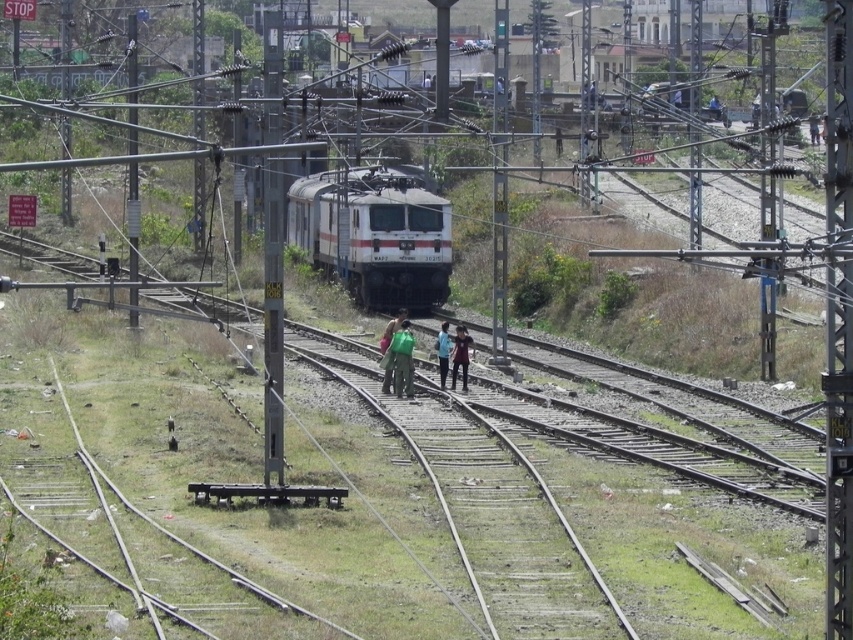
Question: Which point is farther to the camera?

Choices:
 (A) green fabric bag at center
 (B) green fabric at center
 (C) dark blue shirt at center

Answer: (C)

Question: Can you confirm if white glossy train at center is bigger than green fabric at center?

Choices:
 (A) no
 (B) yes

Answer: (B)

Question: Among these points, which one is farthest from the camera?

Choices:
 (A) (433, 298)
 (B) (457, 326)
 (C) (399, 321)

Answer: (A)

Question: Which point is farther to the camera?

Choices:
 (A) green fabric bag at center
 (B) blue fabric shirt at center
 (C) white glossy train at center
 (D) green fabric at center

Answer: (C)

Question: Is green fabric bag at center thinner than green fabric at center?

Choices:
 (A) yes
 (B) no

Answer: (A)

Question: Does white glossy train at center have a smaller size compared to dark blue shirt at center?

Choices:
 (A) no
 (B) yes

Answer: (A)